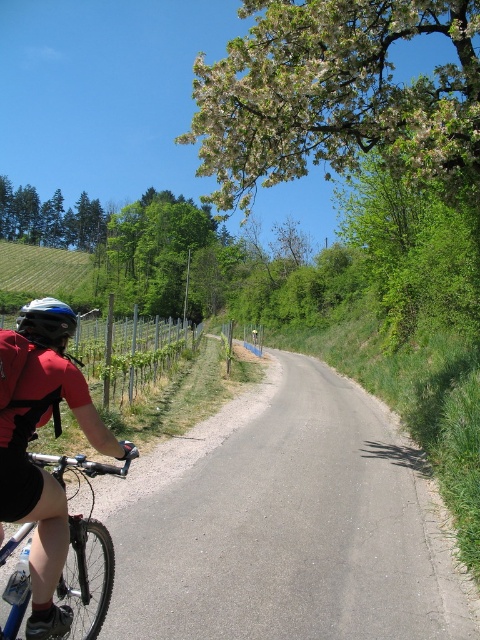
You are a cyclist who wants to check if your blue matte bicycle at lower left is placed correctly according to safety guidelines. According to the guidelines, the bicycle should be positioned to the right of the matte black helmet at left. Is your bicycle positioned correctly?

Yes, the blue matte bicycle at lower left is positioned on the right side of the matte black helmet at left, so it meets the safety guidelines.

You are a photographer standing at the edge of the vineyard, trying to capture a photo of the blue matte bicycle at lower left and the matte black helmet at left. Based on their sizes in the image, which object appears smaller?

The blue matte bicycle at lower left is shorter than the matte black helmet at left, so it appears smaller in the photo.

You are a pedestrian standing on the sidewalk next to the vineyard. You see the blue matte bicycle at lower left and the matte black helmet at left. Which object is closer to you?

The blue matte bicycle at lower left is closer to you because it is positioned in front of the matte black helmet at left.